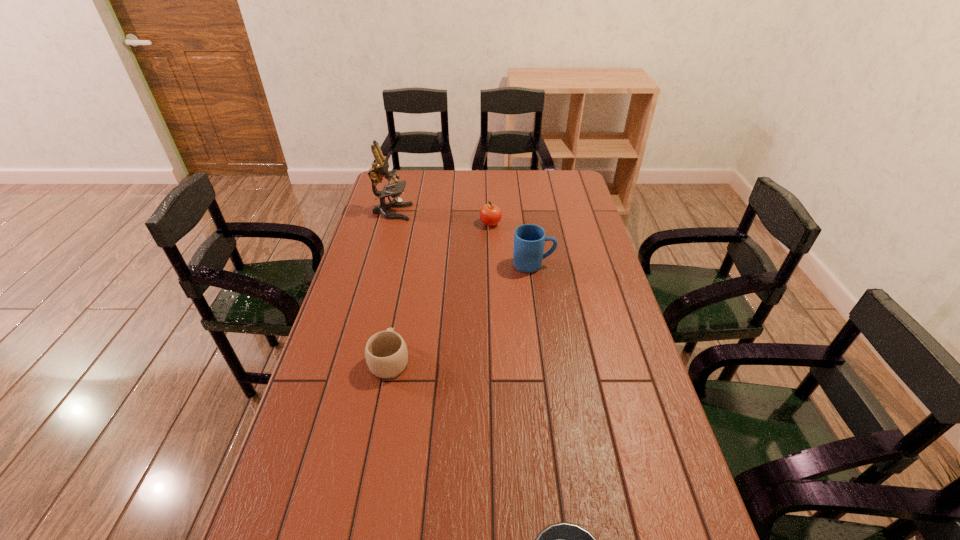
This screenshot has width=960, height=540. I want to click on vacant area that lies between the farther mug and the third tallest object, so [512, 245].

Locate an element on the screen. free space between the third shortest object and the third farthest object is located at coordinates (512, 245).

Where is `empty space that is in between the third farthest object and the tallest object`? Image resolution: width=960 pixels, height=540 pixels. empty space that is in between the third farthest object and the tallest object is located at coordinates (463, 239).

This screenshot has width=960, height=540. I want to click on vacant space that's between the tallest object and the left mug, so click(x=391, y=286).

The image size is (960, 540). Find the location of `vacant region between the left mug and the fourth shortest object`. vacant region between the left mug and the fourth shortest object is located at coordinates (462, 313).

The height and width of the screenshot is (540, 960). Find the location of `free space between the shorter mug and the tallest object`. free space between the shorter mug and the tallest object is located at coordinates (391, 286).

Choose which object is the second nearest neighbor to the saucepan. Please provide its 2D coordinates. Your answer should be formatted as a tuple, i.e. [(x, y)], where the tuple contains the x and y coordinates of a point satisfying the conditions above.

[(529, 239)]

Where is `object identified as the closest to the nearer mug`? The width and height of the screenshot is (960, 540). object identified as the closest to the nearer mug is located at coordinates (529, 239).

Locate an element on the screen. This screenshot has height=540, width=960. vacant region that satisfies the following two spatial constraints: 1. on the side of the second nearest object with the handle; 2. at the eyepieces of the microscope is located at coordinates (419, 212).

You are a GUI agent. You are given a task and a screenshot of the screen. Output one action in this format:
    pyautogui.click(x=<x>, y=<y>)
    Task: Click on the vacant space that satisfies the following two spatial constraints: 1. on the side of the left mug with the handle; 2. at the eyepieces of the microscope
    The height and width of the screenshot is (540, 960).
    Given the screenshot: What is the action you would take?
    (x=419, y=212)